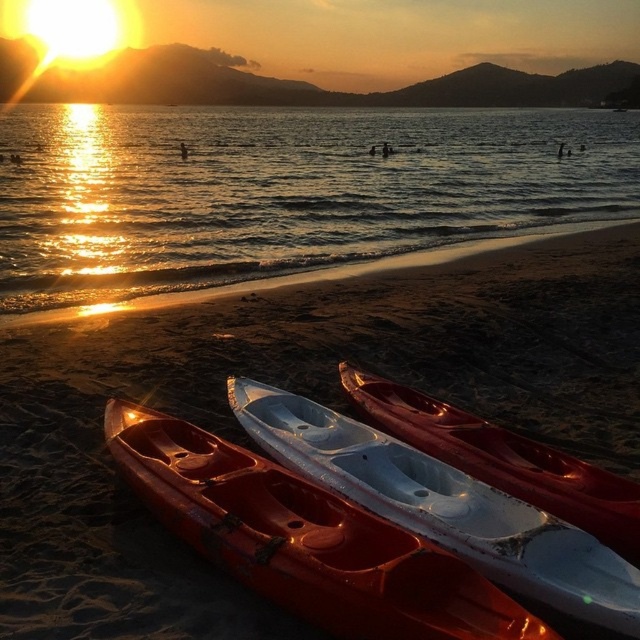
You are planning to walk from the matte orange canoe at lower left to the smooth sand at lower center. Considering the size difference between them, which direction should you head towards?

The smooth sand at lower center is larger in size than the matte orange canoe at lower left, so you should head towards the direction of the smooth sand at lower center to reach your destination.

You are standing on the beach and want to walk from the smooth sand at lower center to the matte orange canoe at lower left. Which direction should you move in?

You should move towards the matte orange canoe at lower left because the smooth sand at lower center is further away from you than the matte orange canoe at lower left.

You are planning to walk from the smooth sand at lower center to the shiny golden water at lower left. Considering their widths, which one is narrower?

The smooth sand at lower center has a width less than the shiny golden water at lower left, so the smooth sand at lower center is narrower.